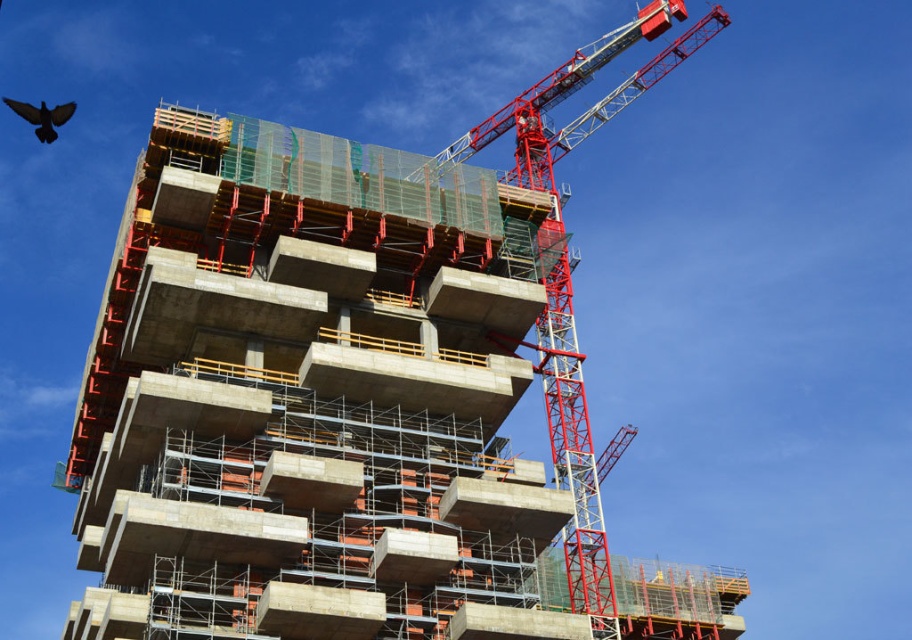
You are an architect inspecting the construction site. You notice the concrete at center and the metallic red crane at upper right. Which object has a greater width according to the description?

The metallic red crane at upper right has a greater width than the concrete at center because the description states that the concrete at center is narrower.

You are an architect observing the construction site. You need to determine which object is taller between the concrete at center and the metallic red crane at upper right. Based on the scene, which one is taller?

The metallic red crane at upper right is taller than the concrete at center.